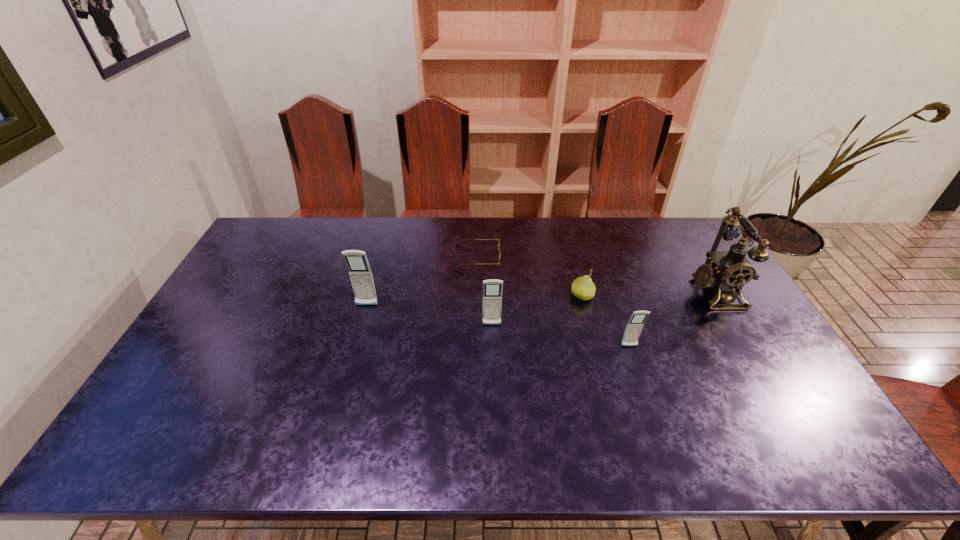
Please point out where to position a new cellular telephone on the right to maintain spacing. Please provide its 2D coordinates. Your answer should be formatted as a tuple, i.e. [(x, y)], where the tuple contains the x and y coordinates of a point satisfying the conditions above.

[(781, 370)]